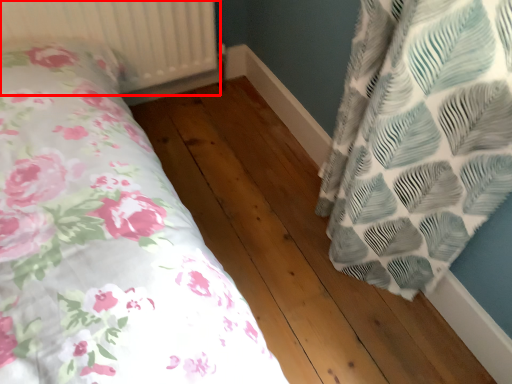
Question: Observing the image, what is the correct spatial positioning of radiator (annotated by the red box) in reference to hardwood?

Choices:
 (A) right
 (B) left

Answer: (B)